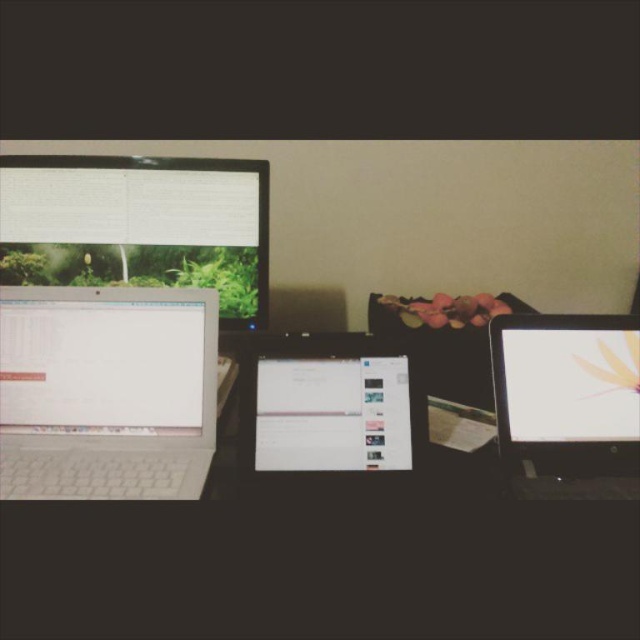
Question: Which object is farther from the camera taking this photo?

Choices:
 (A) white glossy tablet at center
 (B) white plastic laptop at left
 (C) matte plastic monitor at upper left

Answer: (C)

Question: Is white plastic laptop at left positioned before white glossy monitor at right?

Choices:
 (A) no
 (B) yes

Answer: (B)

Question: Considering the real-world distances, which object is closest to the white glossy monitor at right?

Choices:
 (A) matte plastic monitor at upper left
 (B) white plastic laptop at left
 (C) white glossy tablet at center

Answer: (C)

Question: Does white plastic laptop at left have a lesser width compared to white glossy tablet at center?

Choices:
 (A) yes
 (B) no

Answer: (B)

Question: Can you confirm if matte plastic monitor at upper left is positioned to the right of white glossy tablet at center?

Choices:
 (A) yes
 (B) no

Answer: (B)

Question: Which of the following is the farthest from the observer?

Choices:
 (A) white glossy monitor at right
 (B) white plastic laptop at left
 (C) white glossy tablet at center
 (D) matte plastic monitor at upper left

Answer: (D)